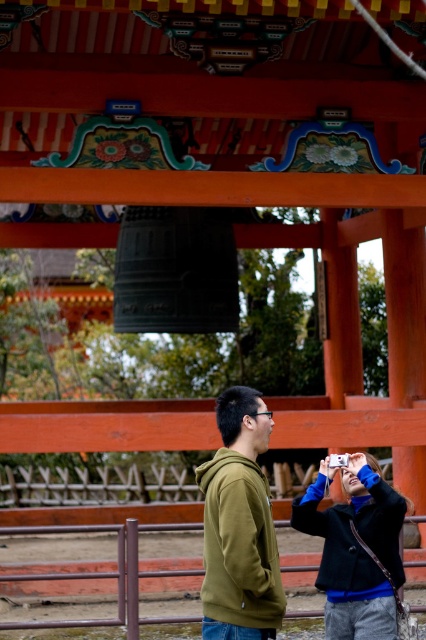
Question: Among these points, which one is nearest to the camera?

Choices:
 (A) (339, 509)
 (B) (230, 445)

Answer: (B)

Question: Among these objects, which one is farthest from the camera?

Choices:
 (A) green matte hoodie at center
 (B) dark blue textured jacket at lower right

Answer: (B)

Question: Does green matte hoodie at center appear over dark blue textured jacket at lower right?

Choices:
 (A) yes
 (B) no

Answer: (A)

Question: Can you confirm if green matte hoodie at center is thinner than dark blue textured jacket at lower right?

Choices:
 (A) yes
 (B) no

Answer: (A)

Question: Is green matte hoodie at center further to the viewer compared to dark blue textured jacket at lower right?

Choices:
 (A) no
 (B) yes

Answer: (A)